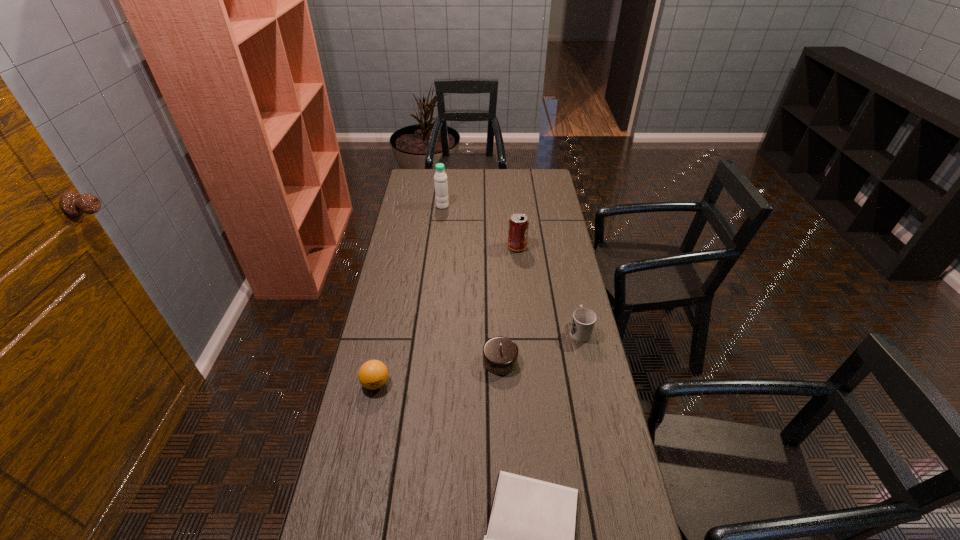
I want to click on the closest object to the nearest object, so click(500, 354).

Identify the location of free space that satisfies the following two spatial constraints: 1. on the back side of the chocolate cake; 2. on the right side of the fifth nearest object. (495, 247).